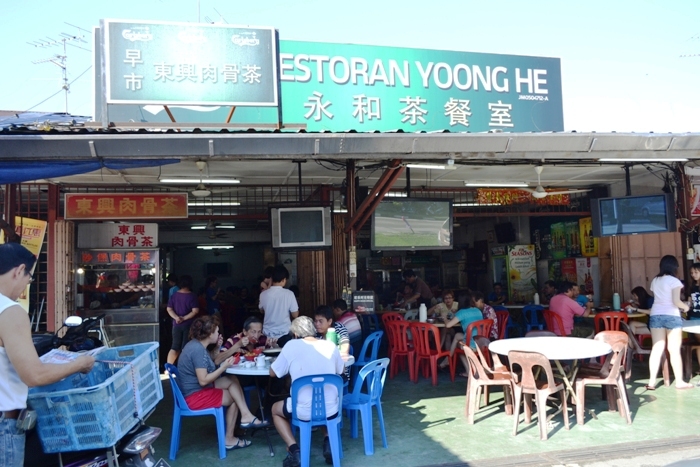
Image resolution: width=700 pixels, height=467 pixels. What are the coordinates of `red chairs` in the screenshot? It's located at (392, 312), (396, 332), (432, 332), (476, 331), (503, 312), (616, 322), (547, 322), (640, 339).